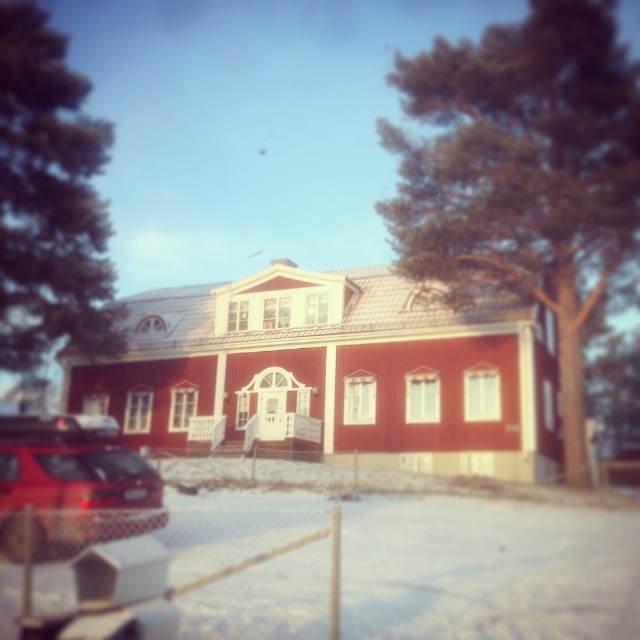
Question: Which point is closer to the camera taking this photo?

Choices:
 (A) (36, 308)
 (B) (556, 308)

Answer: (B)

Question: Is green textured tree at upper right positioned before green textured tree at upper left?

Choices:
 (A) no
 (B) yes

Answer: (B)

Question: Which of the following is the closest to the observer?

Choices:
 (A) green textured tree at upper left
 (B) shiny red car at lower left
 (C) green textured tree at upper right

Answer: (B)

Question: Is green textured tree at upper right behind shiny red car at lower left?

Choices:
 (A) no
 (B) yes

Answer: (B)

Question: Which object is closer to the camera taking this photo?

Choices:
 (A) green textured tree at upper right
 (B) shiny red car at lower left
 (C) green textured tree at upper left

Answer: (B)

Question: Can you confirm if green textured tree at upper right is smaller than shiny red car at lower left?

Choices:
 (A) yes
 (B) no

Answer: (B)